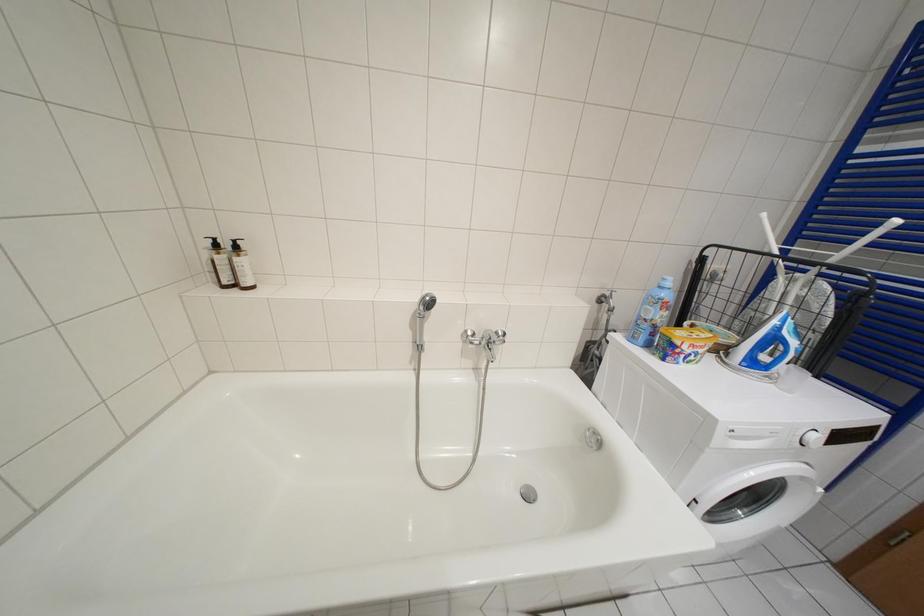
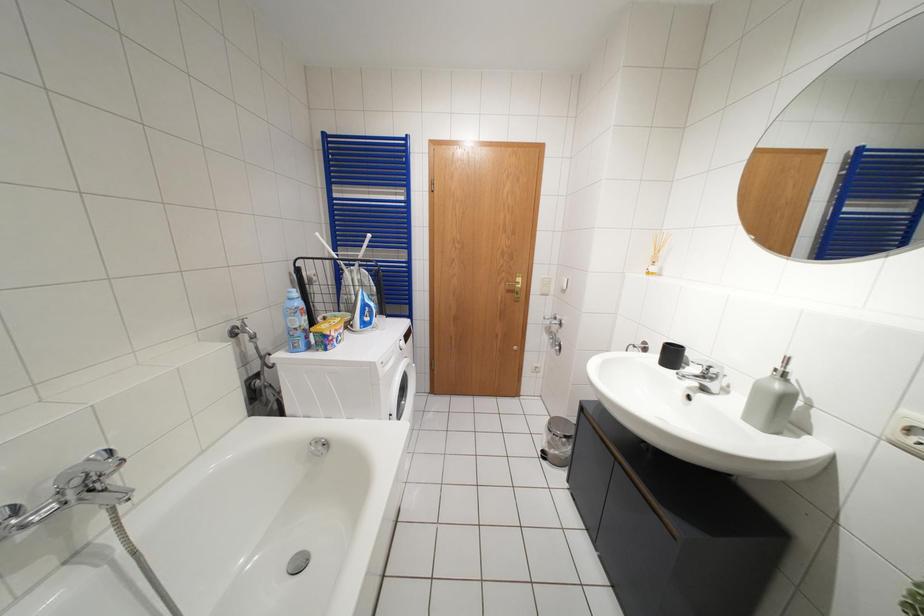
Question: How did the camera likely rotate?

Choices:
 (A) Left
 (B) Right
 (C) Up
 (D) Down

Answer: (B)